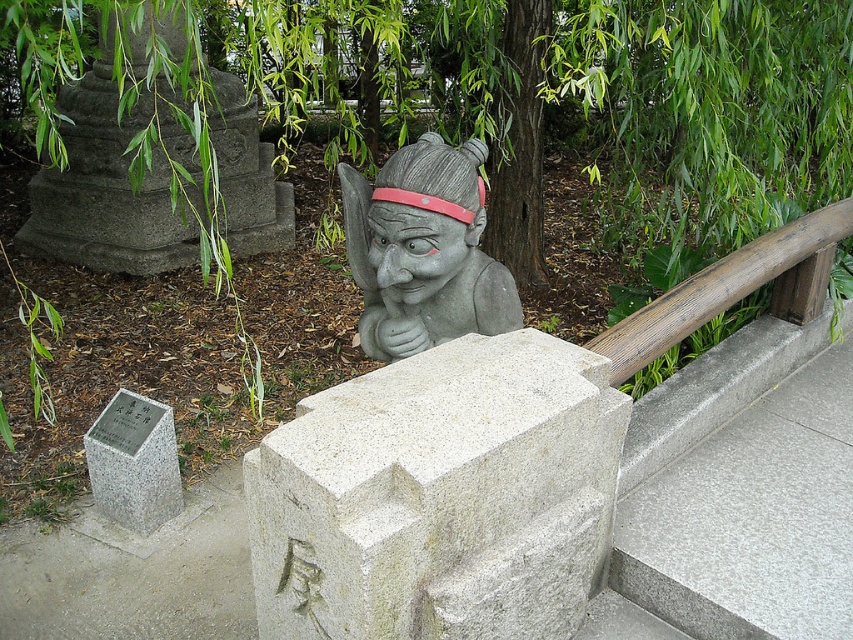
Question: Which object is positioned farthest from the white stone at center?

Choices:
 (A) gray stone statue at center
 (B) gray polished concrete at upper right
 (C) green leafy tree at upper center
 (D) gray granite marker at lower left

Answer: (D)

Question: Is green leafy tree at upper center further to camera compared to white stone at center?

Choices:
 (A) no
 (B) yes

Answer: (B)

Question: Which point is closer to the camera?

Choices:
 (A) gray polished concrete at upper right
 (B) gray stone statue at center

Answer: (A)

Question: Which of the following is the farthest from the observer?

Choices:
 (A) green leafy tree at upper center
 (B) gray granite marker at lower left
 (C) white stone at center

Answer: (B)

Question: Does gray stone statue at center have a lesser width compared to gray granite marker at lower left?

Choices:
 (A) yes
 (B) no

Answer: (B)

Question: Is green leafy tree at upper center to the right of gray polished concrete at upper right from the viewer's perspective?

Choices:
 (A) no
 (B) yes

Answer: (A)